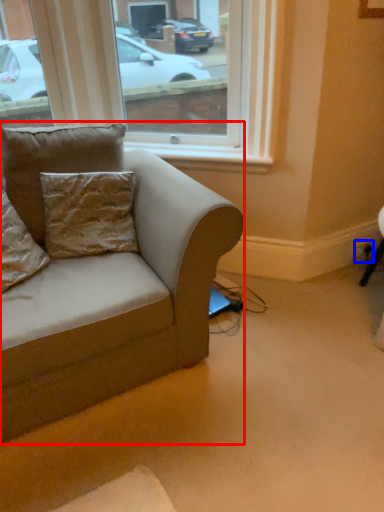
Question: Which point is further to the camera, studio couch (highlighted by a red box) or electric outlet (highlighted by a blue box)?

Choices:
 (A) studio couch
 (B) electric outlet

Answer: (B)